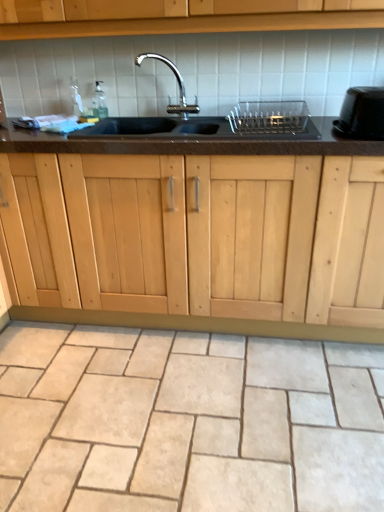
Question: Does black granite sink at center have a greater width compared to beige stone tile at lower center?

Choices:
 (A) yes
 (B) no

Answer: (B)

Question: Is black granite sink at center closer to camera compared to beige stone tile at lower center?

Choices:
 (A) no
 (B) yes

Answer: (A)

Question: From the image's perspective, does black granite sink at center appear lower than beige stone tile at lower center?

Choices:
 (A) yes
 (B) no

Answer: (B)

Question: Does black granite sink at center have a larger size compared to beige stone tile at lower center?

Choices:
 (A) no
 (B) yes

Answer: (B)

Question: Does black granite sink at center have a smaller size compared to beige stone tile at lower center?

Choices:
 (A) no
 (B) yes

Answer: (A)

Question: From the image's perspective, is black glossy toaster at right, the second appliance positioned from the left, located above or below beige stone tile at lower center?

Choices:
 (A) above
 (B) below

Answer: (A)

Question: From a real-world perspective, is black glossy toaster at right, the second appliance positioned from the left, above or below beige stone tile at lower center?

Choices:
 (A) below
 (B) above

Answer: (B)

Question: From their relative heights in the image, would you say black glossy toaster at right, the second appliance positioned from the left, is taller or shorter than beige stone tile at lower center?

Choices:
 (A) short
 (B) tall

Answer: (B)

Question: Relative to beige stone tile at lower center, is black glossy toaster at right, the second appliance positioned from the left, in front or behind?

Choices:
 (A) front
 (B) behind

Answer: (B)

Question: In terms of height, does black glossy toaster at right, the second appliance positioned from the left, look taller or shorter compared to black granite sink at center?

Choices:
 (A) short
 (B) tall

Answer: (A)

Question: Do you think black glossy toaster at right, the second appliance positioned from the left, is within black granite sink at center, or outside of it?

Choices:
 (A) inside
 (B) outside

Answer: (B)

Question: Does point (352, 115) appear closer or farther from the camera than point (89, 138)?

Choices:
 (A) closer
 (B) farther

Answer: (A)

Question: Is black glossy toaster at right, the second appliance positioned from the left, in front of or behind black granite sink at center in the image?

Choices:
 (A) front
 (B) behind

Answer: (A)

Question: From the image's perspective, is black granite sink at center located above or below beige stone tile at lower center?

Choices:
 (A) above
 (B) below

Answer: (A)

Question: In terms of width, does black granite sink at center look wider or thinner when compared to beige stone tile at lower center?

Choices:
 (A) wide
 (B) thin

Answer: (B)